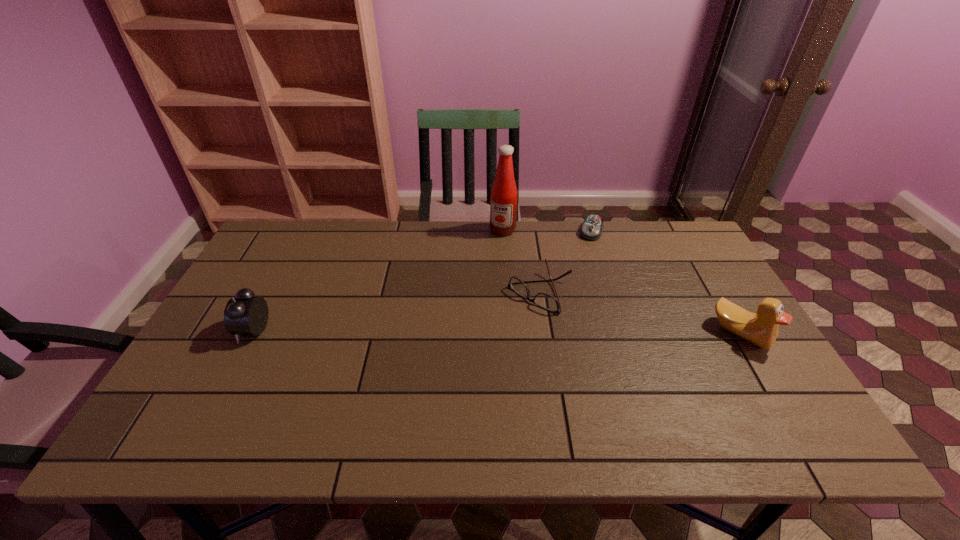
The height and width of the screenshot is (540, 960). I want to click on free space between the condiment and the rightmost object, so click(622, 281).

The image size is (960, 540). I want to click on vacant space that's between the leftmost object and the spectacles, so click(x=397, y=311).

In order to click on unoccupied position between the duck and the spectacles in this screenshot , I will do `click(640, 313)`.

Find the location of a particular element. The width and height of the screenshot is (960, 540). vacant area that lies between the computer mouse and the leftmost object is located at coordinates (422, 280).

Locate an element on the screen. This screenshot has width=960, height=540. vacant area between the condiment and the spectacles is located at coordinates (521, 261).

What are the coordinates of `vacant space that is in between the leftmost object and the spectacles` in the screenshot? It's located at click(x=397, y=311).

Locate an element on the screen. The image size is (960, 540). vacant space that is in between the tallest object and the duck is located at coordinates (622, 281).

Identify the location of vacant region between the tallest object and the spectacles. This screenshot has width=960, height=540. (x=521, y=261).

At what (x,y) coordinates should I click in order to perform the action: click on object that is the fourth closest to the computer mouse. Please return your answer as a coordinate pair (x, y). This screenshot has width=960, height=540. Looking at the image, I should click on (244, 314).

You are a GUI agent. You are given a task and a screenshot of the screen. Output one action in this format:
    pyautogui.click(x=<x>, y=<y>)
    Task: Click on the object that stands as the third closest to the condiment
    Image resolution: width=960 pixels, height=540 pixels.
    Given the screenshot: What is the action you would take?
    pyautogui.click(x=761, y=328)